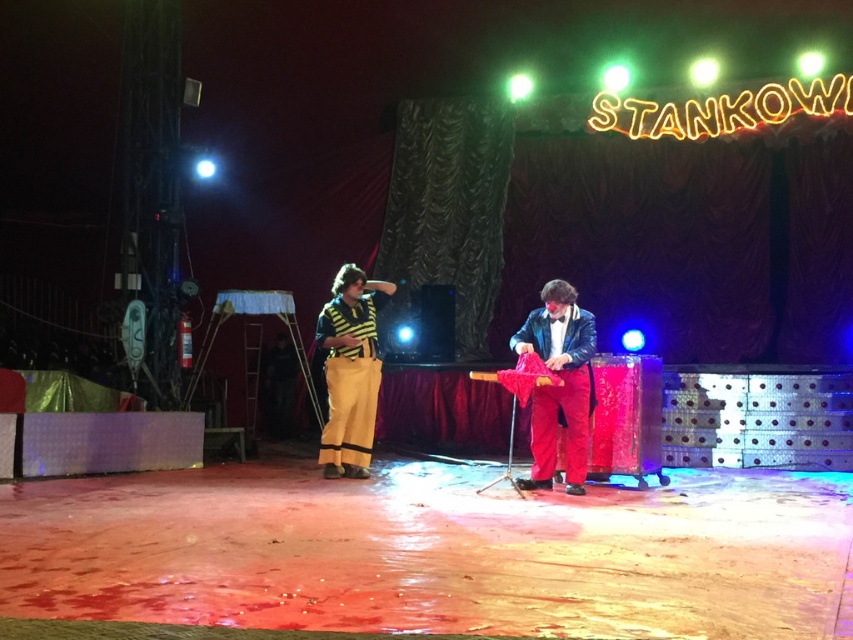
Does shiny red pants at center appear over yellow striped pants at left?

Actually, shiny red pants at center is below yellow striped pants at left.

Who is shorter, shiny red pants at center or yellow striped pants at left?

Standing shorter between the two is shiny red pants at center.

Describe the element at coordinates (560, 387) in the screenshot. The width and height of the screenshot is (853, 640). I see `shiny red pants at center` at that location.

The image size is (853, 640). What are the coordinates of `shiny red pants at center` in the screenshot? It's located at (560, 387).